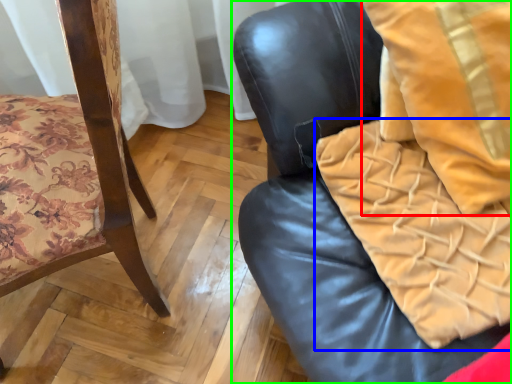
Question: Considering the real-world distances, which object is farthest from throw pillow (highlighted by a red box)? blanket (highlighted by a blue box) or chair (highlighted by a green box)?

Choices:
 (A) blanket
 (B) chair

Answer: (B)